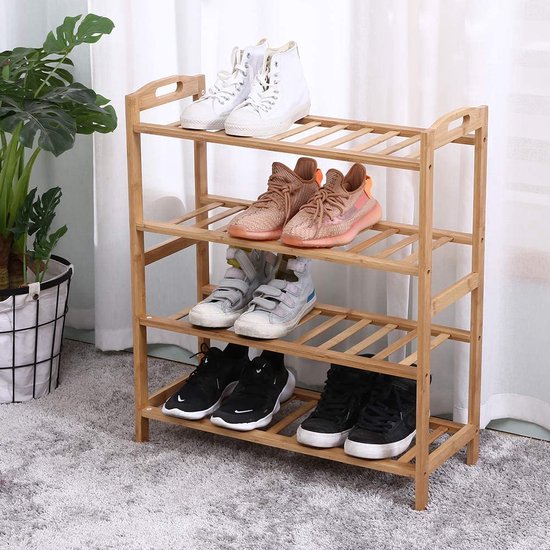
I want to click on shoes on bottom shelf, so click(x=197, y=390), click(x=242, y=412), click(x=329, y=423), click(x=373, y=438).